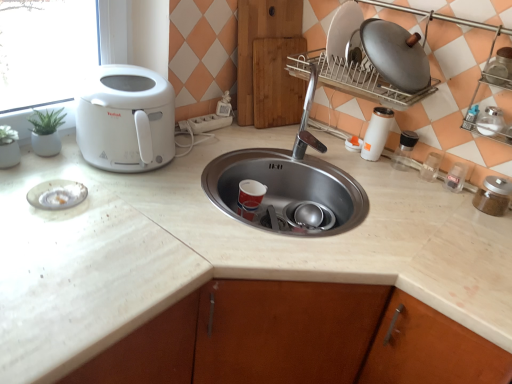
You are a GUI agent. You are given a task and a screenshot of the screen. Output one action in this format:
    pyautogui.click(x=<x>, y=<y>)
    Task: Click on the free location in front of white glossy thermos at right, the seventh appliance positioned from the right
    
    Given the screenshot: What is the action you would take?
    pyautogui.click(x=384, y=176)